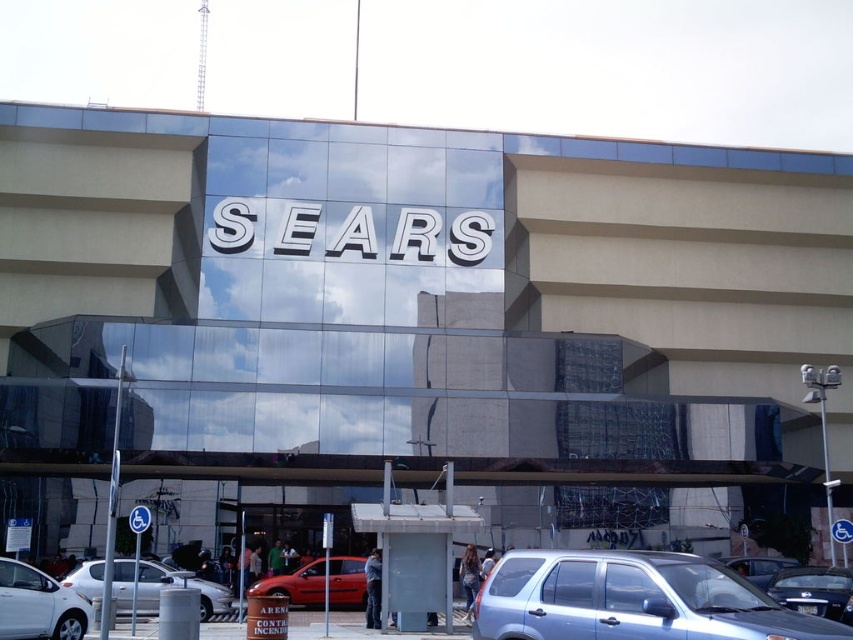
You are standing at the entrance of the Sears store and want to locate the satin blue suv at lower right. According to the coordinates provided, where exactly is it positioned?

The satin blue suv at lower right is positioned at point (631,600).

You are a delivery person who needs to park your 5.5 meter long truck between the satin blue suv at lower right and the white glossy sedan at lower left. Based on the scene, can you fit your truck in that space?

The satin blue suv at lower right and white glossy sedan at lower left are 20.83 meters apart. Since your truck is 5.5 meters long, there is enough space between them to park your truck.

You are a delivery driver who needs to park your truck between the satin blue suv at lower right and the metallic silver sedan at lower right. Is there enough space between them to fit your truck?

The satin blue suv at lower right is positioned over metallic silver sedan at lower right, which means they are parked next to each other without space in between. Therefore, there is no space to fit your truck between them.